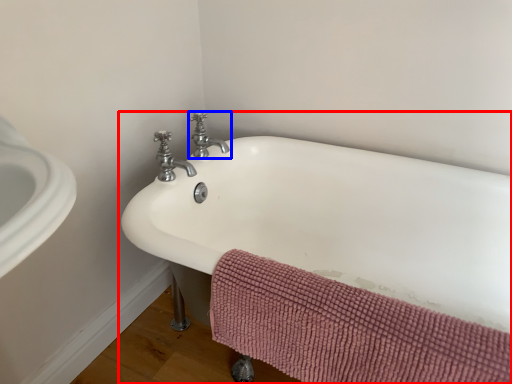
Question: Among these objects, which one is farthest to the camera, bathtub (highlighted by a red box) or tap (highlighted by a blue box)?

Choices:
 (A) bathtub
 (B) tap

Answer: (B)